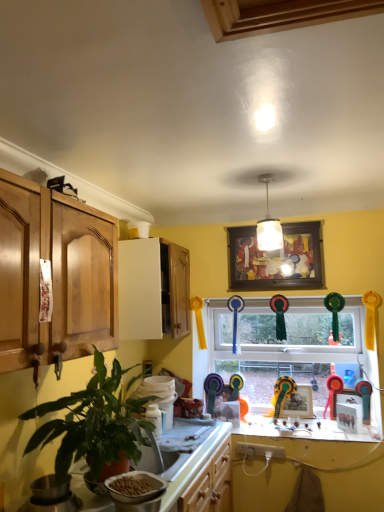
Question: Is matte wooden picture frame at center, the 1th picture frame ordered from the bottom, wider or thinner than green leafy plant at left?

Choices:
 (A) thin
 (B) wide

Answer: (A)

Question: In terms of height, does matte wooden picture frame at center, which appears as the 2th picture frame when viewed from the front, look taller or shorter compared to green leafy plant at left?

Choices:
 (A) short
 (B) tall

Answer: (A)

Question: Which is farther from the wooden framed artwork at center, acting as the first picture frame starting from the top?

Choices:
 (A) matte wooden picture frame at center, acting as the second picture frame starting from the top
 (B) metallic gold trophy at window
 (C) white glass pendant light at center
 (D) yellow matte counter top at lower center
 (E) glass window at center

Answer: (D)

Question: Which is farther from the glass window at center?

Choices:
 (A) green leafy plant at left
 (B) matte wooden picture frame at center, which appears as the 2th picture frame when viewed from the front
 (C) white glass pendant light at center
 (D) wooden framed artwork at center, positioned as the second picture frame in bottom-to-top order
 (E) yellow matte counter top at lower center

Answer: (A)